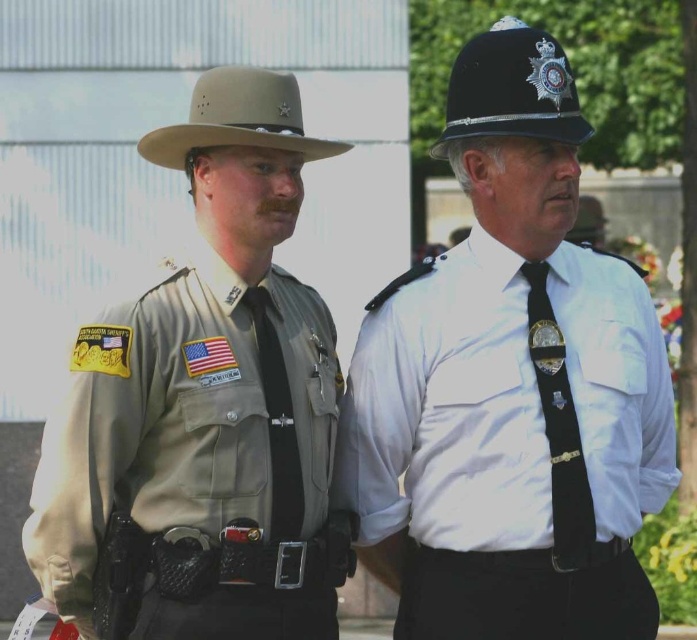
From the picture: You are a photographer setting up for a group photo. You need to position yourself so that both the tan uniform at left and the black matte helmet at upper center are in focus. Which object should you focus on first to ensure both are sharp?

You should focus on the tan uniform at left first because it is closer to the viewer than the black matte helmet at upper center. By focusing on the closer object, the depth of field will extend to include the farther object as well, ensuring both are in focus.